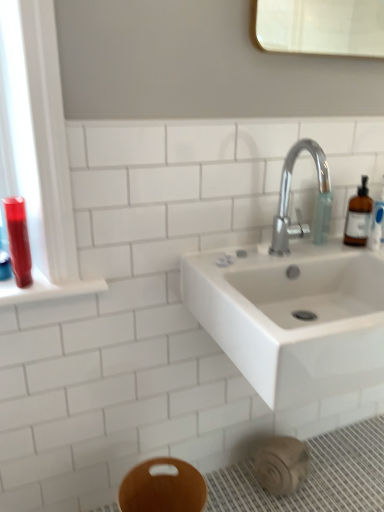
Question: Should I look upward or downward to see translucent plastic soap dispenser at upper right?

Choices:
 (A) up
 (B) down

Answer: (A)

Question: Is translucent plastic soap dispenser at upper right taller than translucent amber bottle at right?

Choices:
 (A) no
 (B) yes

Answer: (A)

Question: Is translucent plastic soap dispenser at upper right smaller than translucent amber bottle at right?

Choices:
 (A) no
 (B) yes

Answer: (B)

Question: Are translucent plastic soap dispenser at upper right and translucent amber bottle at right beside each other?

Choices:
 (A) no
 (B) yes

Answer: (A)

Question: Is translucent plastic soap dispenser at upper right positioned in front of translucent amber bottle at right?

Choices:
 (A) yes
 (B) no

Answer: (B)

Question: From a real-world perspective, is translucent plastic soap dispenser at upper right under translucent amber bottle at right?

Choices:
 (A) no
 (B) yes

Answer: (B)

Question: Would you say translucent plastic soap dispenser at upper right contains translucent amber bottle at right?

Choices:
 (A) no
 (B) yes

Answer: (A)

Question: From the image's perspective, does translucent amber bottle at right appear lower than wooden bidet at lower center?

Choices:
 (A) no
 (B) yes

Answer: (A)

Question: Is translucent amber bottle at right facing away from wooden bidet at lower center?

Choices:
 (A) yes
 (B) no

Answer: (B)

Question: Is translucent amber bottle at right closer to the viewer compared to wooden bidet at lower center?

Choices:
 (A) no
 (B) yes

Answer: (A)

Question: Is translucent amber bottle at right at the left side of wooden bidet at lower center?

Choices:
 (A) no
 (B) yes

Answer: (A)

Question: Is the position of translucent amber bottle at right more distant than that of wooden bidet at lower center?

Choices:
 (A) yes
 (B) no

Answer: (A)

Question: Could wooden bidet at lower center be considered to be inside translucent amber bottle at right?

Choices:
 (A) yes
 (B) no

Answer: (B)

Question: Considering the relative positions of shiny red plastic mouthwash at left and translucent amber bottle at right in the image provided, is shiny red plastic mouthwash at left to the right of translucent amber bottle at right from the viewer's perspective?

Choices:
 (A) no
 (B) yes

Answer: (A)